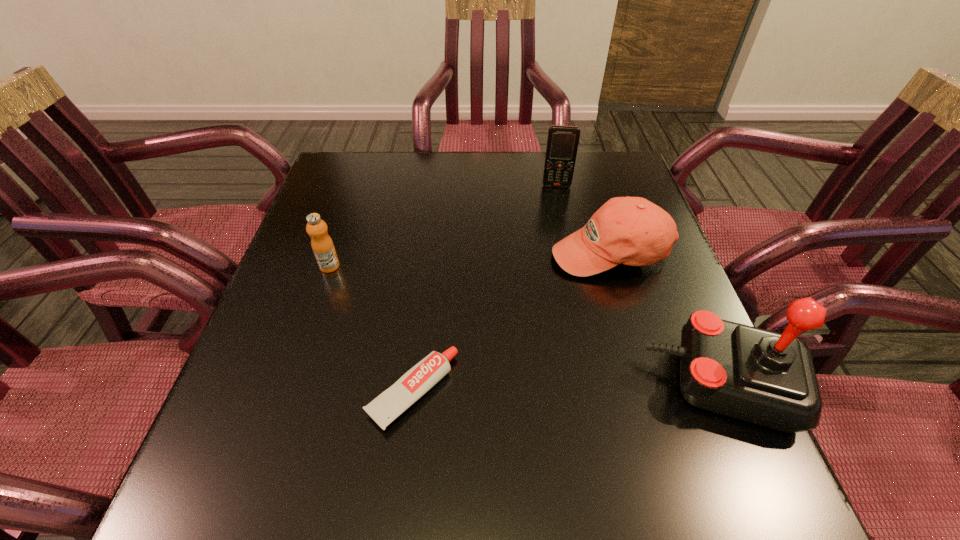
Find the location of a particular element. This screenshot has width=960, height=540. joystick present at the near edge is located at coordinates (759, 376).

You are a GUI agent. You are given a task and a screenshot of the screen. Output one action in this format:
    pyautogui.click(x=<x>, y=<y>)
    Task: Click on the object that is at the left edge
    This screenshot has height=540, width=960.
    Given the screenshot: What is the action you would take?
    pyautogui.click(x=322, y=245)

You are a GUI agent. You are given a task and a screenshot of the screen. Output one action in this format:
    pyautogui.click(x=<x>, y=<y>)
    Task: Click on the joystick situated at the right edge
    This screenshot has width=960, height=540.
    Given the screenshot: What is the action you would take?
    coord(759,376)

Where is `baseball cap that is at the right edge`? The height and width of the screenshot is (540, 960). baseball cap that is at the right edge is located at coordinates (633, 231).

This screenshot has height=540, width=960. Find the location of `object that is at the near right corner`. object that is at the near right corner is located at coordinates (759, 376).

You are a GUI agent. You are given a task and a screenshot of the screen. Output one action in this format:
    pyautogui.click(x=<x>, y=<y>)
    Task: Click on the free location at the far edge
    
    Given the screenshot: What is the action you would take?
    pyautogui.click(x=442, y=169)

You are a GUI agent. You are given a task and a screenshot of the screen. Output one action in this format:
    pyautogui.click(x=<x>, y=<y>)
    Task: Click on the vacant point at the near edge
    The width and height of the screenshot is (960, 540).
    Given the screenshot: What is the action you would take?
    pyautogui.click(x=483, y=410)

This screenshot has height=540, width=960. Find the location of `vacant space at the left edge of the desktop`. vacant space at the left edge of the desktop is located at coordinates (284, 338).

Locate an element on the screen. The width and height of the screenshot is (960, 540). free spot at the right edge of the desktop is located at coordinates (677, 300).

The height and width of the screenshot is (540, 960). In the image, there is a desktop. In order to click on vacant space at the far left corner in this screenshot , I will do `click(376, 166)`.